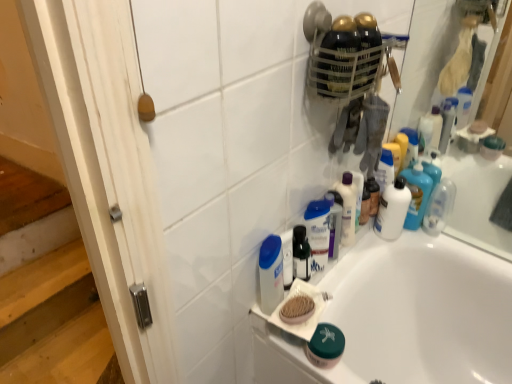
Question: Can you confirm if clear plastic bottle at upper right, which is counted as the first toiletry, starting from the right, is wider than translucent plastic mouthwash at center, the 2th mouthwash when ordered from right to left?

Choices:
 (A) no
 (B) yes

Answer: (B)

Question: Is clear plastic bottle at upper right, which is counted as the first toiletry, starting from the right, outside of translucent plastic mouthwash at center, the 2th mouthwash when ordered from right to left?

Choices:
 (A) yes
 (B) no

Answer: (A)

Question: Does clear plastic bottle at upper right, which is counted as the first toiletry, starting from the right, have a greater height compared to translucent plastic mouthwash at center, arranged as the second mouthwash when viewed from the left?

Choices:
 (A) yes
 (B) no

Answer: (B)

Question: Does clear plastic bottle at upper right, which is counted as the first toiletry, starting from the right, appear on the right side of translucent plastic mouthwash at center, the second mouthwash positioned from the front?

Choices:
 (A) yes
 (B) no

Answer: (A)

Question: From a real-world perspective, is clear plastic bottle at upper right, which is the 4th toiletry from left to right, beneath translucent plastic mouthwash at center, arranged as the second mouthwash when viewed from the left?

Choices:
 (A) no
 (B) yes

Answer: (B)

Question: From a real-world perspective, is translucent plastic mouthwash at center, the 2th mouthwash when ordered from right to left, positioned above or below white wood screen door at left?

Choices:
 (A) above
 (B) below

Answer: (A)

Question: Choose the correct answer: Is translucent plastic mouthwash at center, the second mouthwash positioned from the front, inside white wood screen door at left or outside it?

Choices:
 (A) inside
 (B) outside

Answer: (B)

Question: Is translucent plastic mouthwash at center, the 2th mouthwash when ordered from right to left, bigger or smaller than white wood screen door at left?

Choices:
 (A) big
 (B) small

Answer: (B)

Question: Looking at their shapes, would you say translucent plastic mouthwash at center, the second mouthwash positioned from the front, is wider or thinner than white wood screen door at left?

Choices:
 (A) wide
 (B) thin

Answer: (B)

Question: Considering their positions, is white plastic mouthwash at center, which ranks as the first mouthwash in left-to-right order, located in front of or behind white glossy lotion at upper center, acting as the third toiletry starting from the right?

Choices:
 (A) behind
 (B) front

Answer: (B)

Question: Which is correct: white plastic mouthwash at center, the 3th mouthwash in the back-to-front sequence, is inside white glossy lotion at upper center, marked as the second toiletry in a left-to-right arrangement, or outside of it?

Choices:
 (A) outside
 (B) inside

Answer: (A)

Question: Considering the positions of point (261, 309) and point (330, 235), is point (261, 309) closer or farther from the camera than point (330, 235)?

Choices:
 (A) closer
 (B) farther

Answer: (A)

Question: Considering the positions of white plastic mouthwash at center, which ranks as the first mouthwash in left-to-right order, and white glossy lotion at upper center, marked as the second toiletry in a left-to-right arrangement, in the image, is white plastic mouthwash at center, which ranks as the first mouthwash in left-to-right order, taller or shorter than white glossy lotion at upper center, marked as the second toiletry in a left-to-right arrangement,?

Choices:
 (A) tall
 (B) short

Answer: (B)

Question: From the image's perspective, is clear plastic bottle at upper right, which is the 4th toiletry from left to right, located above or below white glossy lotion at upper center, marked as the second toiletry in a left-to-right arrangement?

Choices:
 (A) below
 (B) above

Answer: (B)

Question: Is clear plastic bottle at upper right, which is the 4th toiletry from left to right, to the left or to the right of white glossy lotion at upper center, marked as the second toiletry in a left-to-right arrangement, in the image?

Choices:
 (A) right
 (B) left

Answer: (A)